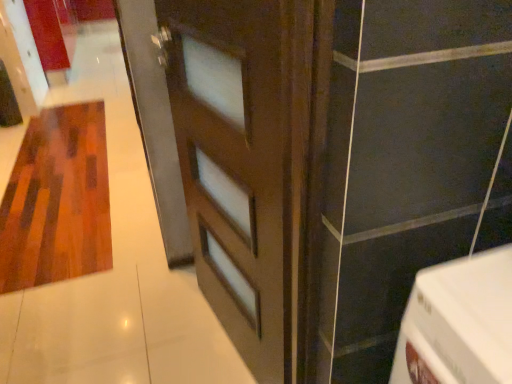
Question: Considering the positions of point (253, 340) and point (34, 258), is point (253, 340) closer or farther from the camera than point (34, 258)?

Choices:
 (A) farther
 (B) closer

Answer: (B)

Question: Is brown matte door at center taller or shorter than wooden textured rug at left?

Choices:
 (A) tall
 (B) short

Answer: (A)

Question: Do you think brown matte door at center is within wooden textured rug at left, or outside of it?

Choices:
 (A) outside
 (B) inside

Answer: (A)

Question: Is point (49, 157) positioned closer to the camera than point (247, 211)?

Choices:
 (A) farther
 (B) closer

Answer: (A)

Question: From the image's perspective, is wooden textured rug at left above or below brown matte door at center?

Choices:
 (A) below
 (B) above

Answer: (B)

Question: Based on their positions, is wooden textured rug at left located to the left or right of brown matte door at center?

Choices:
 (A) left
 (B) right

Answer: (A)

Question: From a real-world perspective, relative to brown matte door at center, is wooden textured rug at left vertically above or below?

Choices:
 (A) above
 (B) below

Answer: (B)